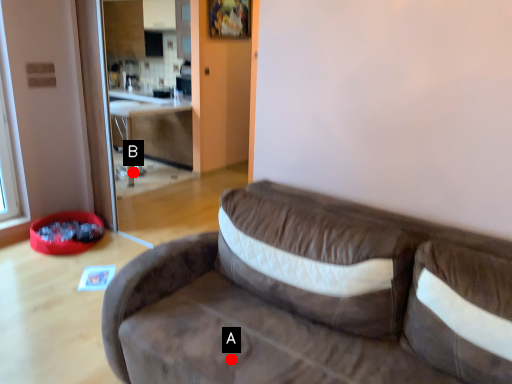
Question: Two points are circled on the image, labeled by A and B beside each circle. Which of the following is the closest to the observer?

Choices:
 (A) A is closer
 (B) B is closer

Answer: (A)